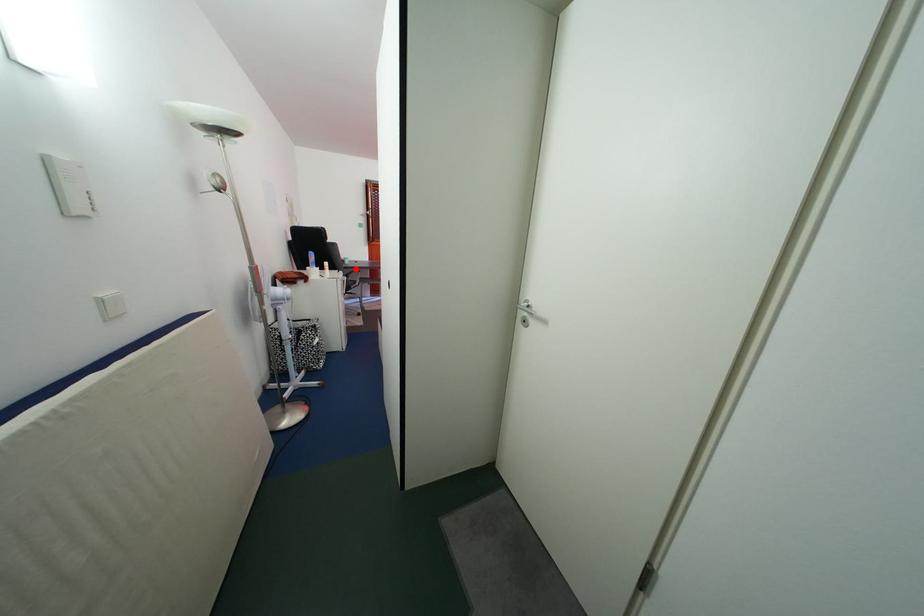
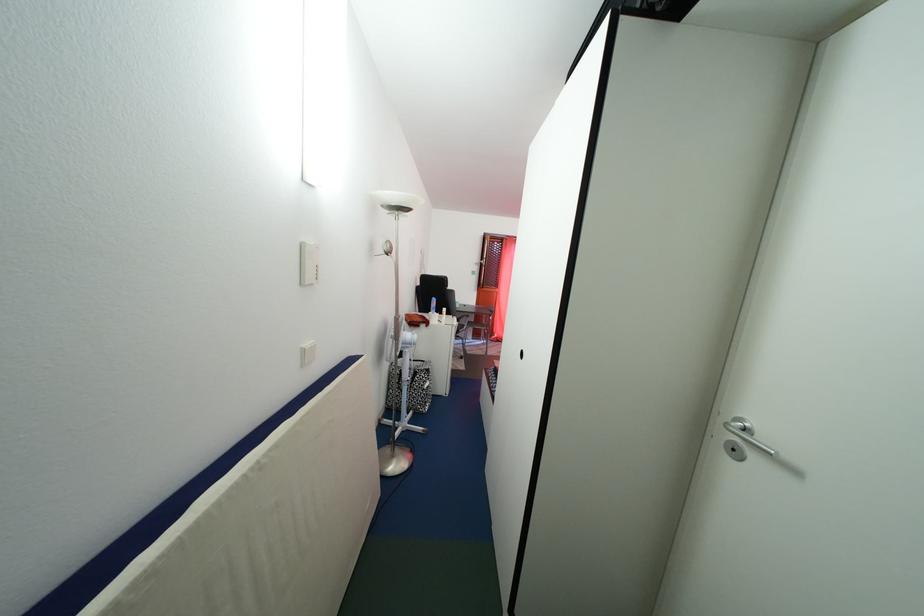
Question: I am providing you with two images of the same scene from different viewpoints. Given a red point in image1, look at the same physical point in image2. Is it:

Choices:
 (A) Closer to the viewpoint
 (B) Farther from the viewpoint

Answer: (B)